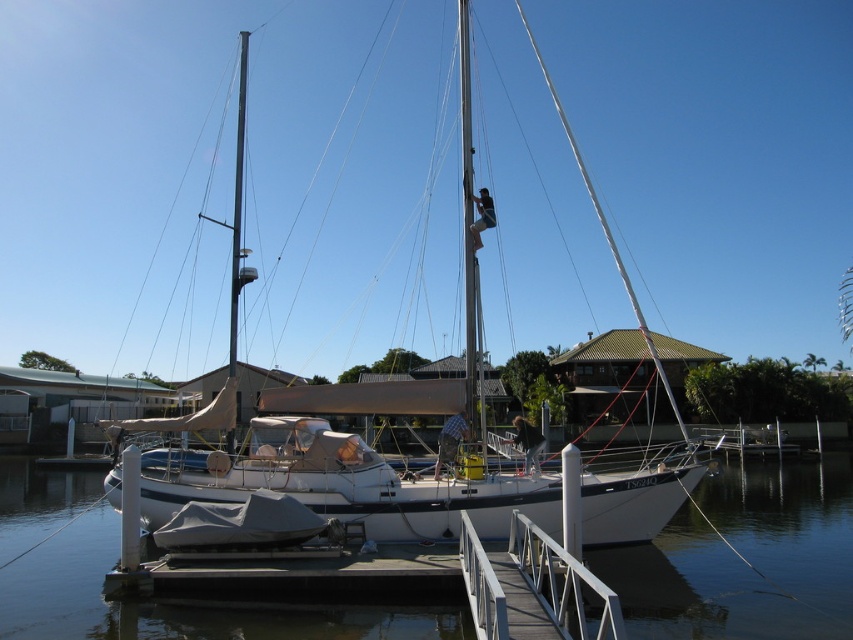
Does white matte sailboat at center appear on the left side of white metal/rail at center?

In fact, white matte sailboat at center is to the right of white metal/rail at center.

Who is shorter, white matte sailboat at center or white metal/rail at center?

white metal/rail at center

This screenshot has width=853, height=640. Identify the location of white matte sailboat at center. (358, 461).

Where is `white matte sailboat at center`? white matte sailboat at center is located at coordinates (358, 461).

Who is shorter, clear water at dock center or white metal/rail at center?

white metal/rail at center

The image size is (853, 640). What do you see at coordinates (746, 556) in the screenshot?
I see `clear water at dock center` at bounding box center [746, 556].

Where is `clear water at dock center`? clear water at dock center is located at coordinates (746, 556).

Does clear water at dock center have a smaller size compared to white matte sailboat at center?

Correct, clear water at dock center occupies less space than white matte sailboat at center.

Measure the distance between point (115, 612) and camera.

Point (115, 612) is 37.22 feet from camera.

Locate an element on the screen. This screenshot has width=853, height=640. clear water at dock center is located at coordinates (x=746, y=556).